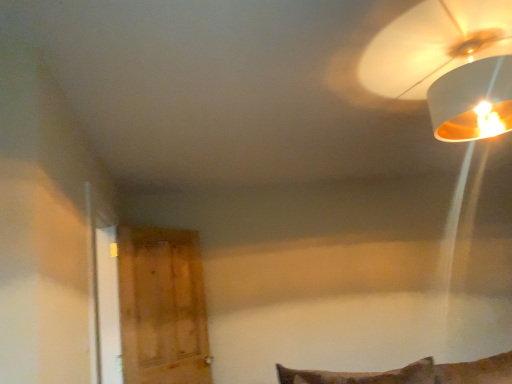
The width and height of the screenshot is (512, 384). Describe the element at coordinates (162, 306) in the screenshot. I see `wooden door at left` at that location.

The height and width of the screenshot is (384, 512). In order to click on wooden door at left in this screenshot , I will do `click(162, 306)`.

Where is `white matte lampshade at upper right`? This screenshot has height=384, width=512. white matte lampshade at upper right is located at coordinates (448, 65).

What do you see at coordinates (448, 65) in the screenshot? Image resolution: width=512 pixels, height=384 pixels. I see `white matte lampshade at upper right` at bounding box center [448, 65].

At what (x,y) coordinates should I click in order to perform the action: click on wooden door at left. Please return your answer as a coordinate pair (x, y). Looking at the image, I should click on (162, 306).

Which is more to the left, wooden door at left or white matte lampshade at upper right?

wooden door at left is more to the left.

Which object is further away from the camera taking this photo, wooden door at left or white matte lampshade at upper right?

Positioned behind is wooden door at left.

Does point (183, 268) appear closer or farther from the camera than point (377, 51)?

Clearly, point (183, 268) is more distant from the camera than point (377, 51).

From the image's perspective, is wooden door at left below white matte lampshade at upper right?

Yes, from the image's perspective, wooden door at left is beneath white matte lampshade at upper right.

From a real-world perspective, is wooden door at left on white matte lampshade at upper right?

No, from a real-world perspective, wooden door at left is not on top of white matte lampshade at upper right.

In terms of width, does wooden door at left look wider or thinner when compared to white matte lampshade at upper right?

Clearly, wooden door at left has less width compared to white matte lampshade at upper right.

Is wooden door at left taller than white matte lampshade at upper right?

Correct, wooden door at left is much taller as white matte lampshade at upper right.

Looking at the image, does wooden door at left seem bigger or smaller compared to white matte lampshade at upper right?

Considering their sizes, wooden door at left takes up less space than white matte lampshade at upper right.

Is white matte lampshade at upper right inside wooden door at left?

That's incorrect, white matte lampshade at upper right is not inside wooden door at left.

Are wooden door at left and white matte lampshade at upper right located far from each other?

wooden door at left is positioned a significant distance from white matte lampshade at upper right.

Looking at this image, is wooden door at left positioned with its back to white matte lampshade at upper right?

That's not correct — wooden door at left is not looking away from white matte lampshade at upper right.

What's the angular difference between wooden door at left and white matte lampshade at upper right's facing directions?

57.4 degrees.

How much distance is there between wooden door at left and white matte lampshade at upper right?

wooden door at left is 2.34 meters away from white matte lampshade at upper right.

This screenshot has height=384, width=512. Identify the location of glass door located underneath the white matte lampshade at upper right (from a real-world perspective). (162, 306).

Is white matte lampshade at upper right to the left of wooden door at left from the viewer's perspective?

No.

Relative to wooden door at left, is white matte lampshade at upper right in front or behind?

Clearly, white matte lampshade at upper right is in front of wooden door at left.

Does point (497, 39) come behind point (122, 274)?

No, (497, 39) is closer to viewer.

From the image's perspective, is white matte lampshade at upper right positioned above or below wooden door at left?

From the image's perspective, white matte lampshade at upper right appears above wooden door at left.

From a real-world perspective, is white matte lampshade at upper right above or below wooden door at left?

white matte lampshade at upper right is above wooden door at left.

Considering the sizes of objects white matte lampshade at upper right and wooden door at left in the image provided, who is wider, white matte lampshade at upper right or wooden door at left?

With larger width is white matte lampshade at upper right.

From their relative heights in the image, would you say white matte lampshade at upper right is taller or shorter than wooden door at left?

white matte lampshade at upper right is shorter than wooden door at left.

Can you confirm if white matte lampshade at upper right is bigger than wooden door at left?

Indeed, white matte lampshade at upper right has a larger size compared to wooden door at left.

Is white matte lampshade at upper right outside of wooden door at left?

That's correct, white matte lampshade at upper right is outside of wooden door at left.

Is the surface of white matte lampshade at upper right in direct contact with wooden door at left?

No, white matte lampshade at upper right is not next to wooden door at left.

Is white matte lampshade at upper right facing towards wooden door at left?

No, white matte lampshade at upper right does not turn towards wooden door at left.

There is a wooden door at left. Identify the location of lamp above it (from a real-world perspective). click(x=448, y=65).

You are a GUI agent. You are given a task and a screenshot of the screen. Output one action in this format:
    pyautogui.click(x=<x>, y=<y>)
    Task: Click on the lamp above the wooden door at left (from the image's perspective)
    The height and width of the screenshot is (384, 512).
    Given the screenshot: What is the action you would take?
    pyautogui.click(x=448, y=65)

Locate an element on the screen. The width and height of the screenshot is (512, 384). glass door lying behind the white matte lampshade at upper right is located at coordinates (162, 306).